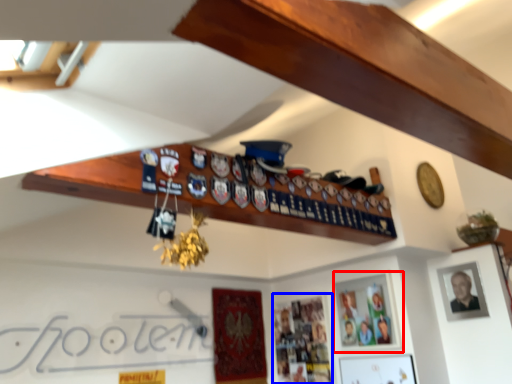
Question: Which object is closer to the camera taking this photo, picture frame (highlighted by a red box) or picture frame (highlighted by a blue box)?

Choices:
 (A) picture frame
 (B) picture frame

Answer: (A)